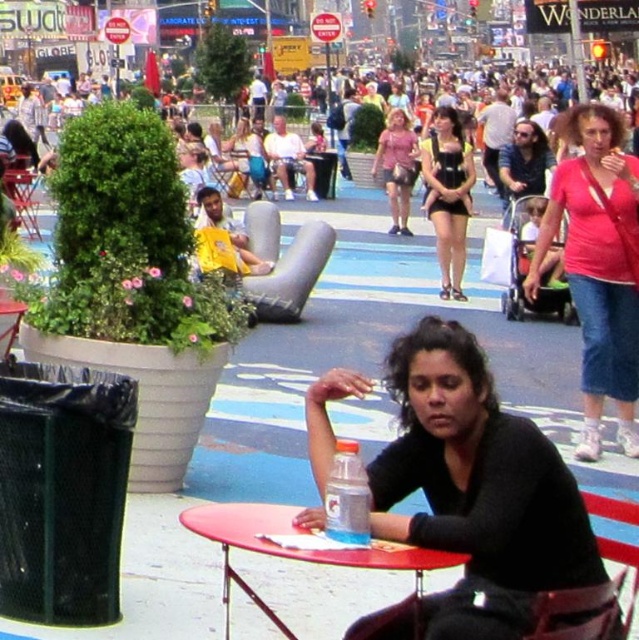
Based on the photo, how far apart are matte pink dress at center and metallic silver chair at center?

The distance of matte pink dress at center from metallic silver chair at center is 10.11 meters.

Which is above, matte pink dress at center or metallic silver chair at center?

Positioned higher is matte pink dress at center.

Between point (404, 176) and point (252, 170), which one is positioned behind?

Positioned behind is point (252, 170).

The image size is (639, 640). I want to click on matte pink dress at center, so click(x=397, y=166).

Can you confirm if smooth plastic table at center is positioned above yellow fabric baby carrier at center?

Actually, smooth plastic table at center is below yellow fabric baby carrier at center.

Which is more to the left, smooth plastic table at center or yellow fabric baby carrier at center?

smooth plastic table at center is more to the left.

Is point (243, 520) less distant than point (252, 282)?

Yes, it is in front of point (252, 282).

This screenshot has width=639, height=640. Find the location of `smooth plastic table at center`. smooth plastic table at center is located at coordinates (295, 548).

Is point (580, 188) positioned in front of point (261, 176)?

That is True.

You are a GUI agent. You are given a task and a screenshot of the screen. Output one action in this format:
    pyautogui.click(x=<x>, y=<y>)
    Task: Click on the pink fabric shirt at upper right
    The image size is (639, 640).
    Given the screenshot: What is the action you would take?
    (x=597, y=266)